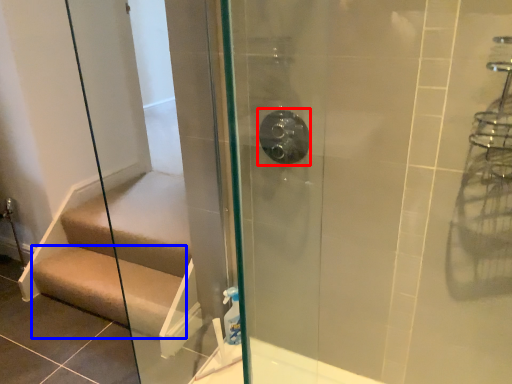
Question: Which object appears farthest to the camera in this image, shower (highlighted by a red box) or stairs (highlighted by a blue box)?

Choices:
 (A) shower
 (B) stairs

Answer: (B)